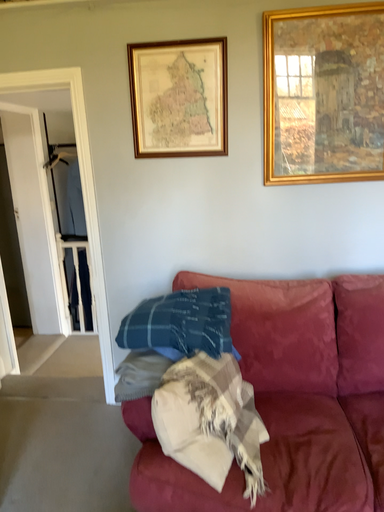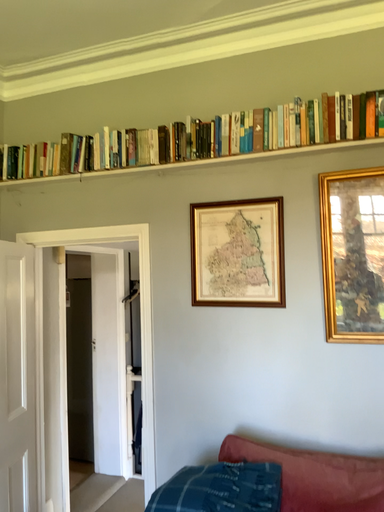
Question: How did the camera likely rotate when shooting the video?

Choices:
 (A) rotated upward
 (B) rotated downward

Answer: (A)